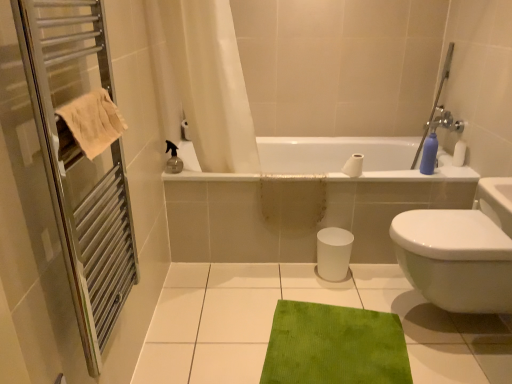
Question: From the image's perspective, is blue matte bottle at upper right positioned above or below green textured mat at lower center?

Choices:
 (A) below
 (B) above

Answer: (B)

Question: Is blue matte bottle at upper right wider or thinner than green textured mat at lower center?

Choices:
 (A) thin
 (B) wide

Answer: (A)

Question: Which is nearer to the green velvety bath mat at center?

Choices:
 (A) blue matte bottle at upper right
 (B) green textured mat at lower center
 (C) white matte toilet paper at upper center
 (D) white glossy bidet at lower right
 (E) white fabric shower curtain at upper center

Answer: (B)

Question: Based on their relative distances, which object is farther from the white matte toilet paper at upper center?

Choices:
 (A) white glossy bathtub at center
 (B) beige cotton towel at left
 (C) white fabric shower curtain at upper center
 (D) blue matte bottle at upper right
 (E) white glossy bidet at lower right

Answer: (B)